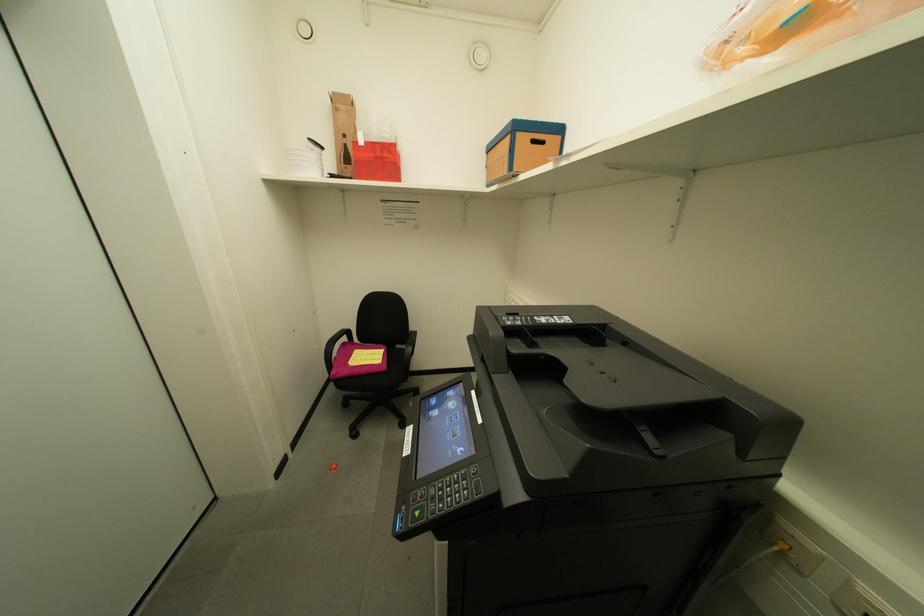
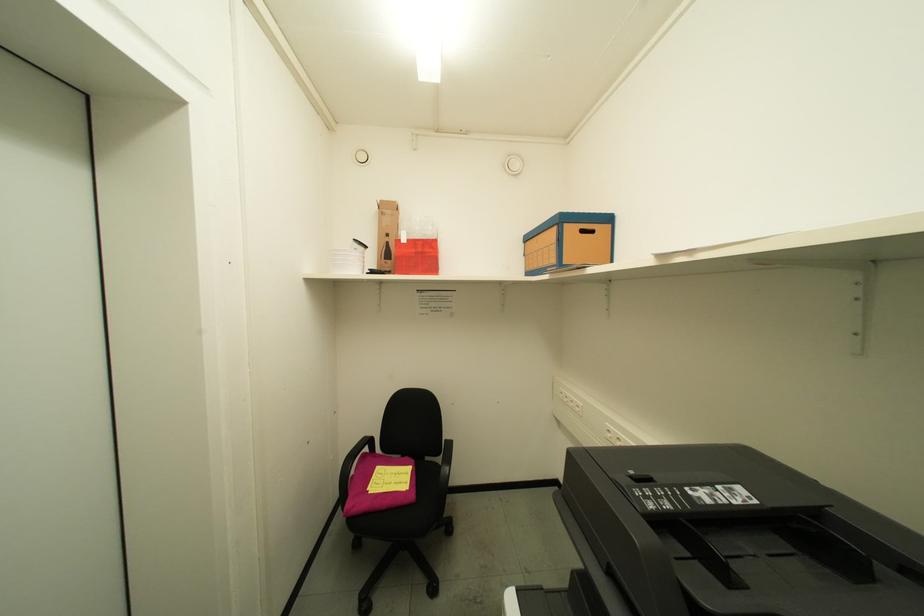
Question: The images are taken continuously from a first-person perspective. In which direction is your viewpoint rotating?

Choices:
 (A) Left
 (B) Right
 (C) Up
 (D) Down

Answer: (C)